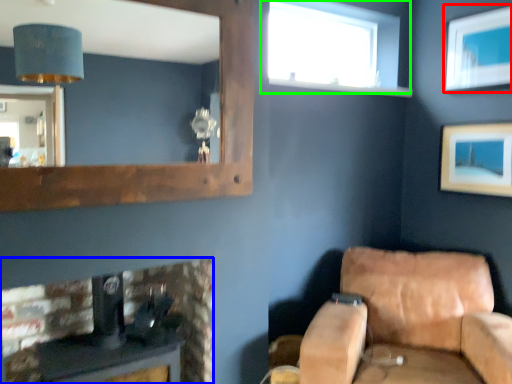
Question: Based on their relative distances, which object is farther from picture frame (highlighted by a red box)? Choose from furniture (highlighted by a blue box) and window (highlighted by a green box).

Choices:
 (A) furniture
 (B) window

Answer: (A)